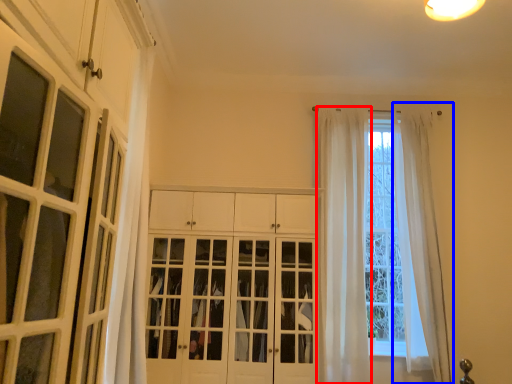
Question: Which object appears farthest to the camera in this image, curtain (highlighted by a red box) or curtain (highlighted by a blue box)?

Choices:
 (A) curtain
 (B) curtain

Answer: (B)